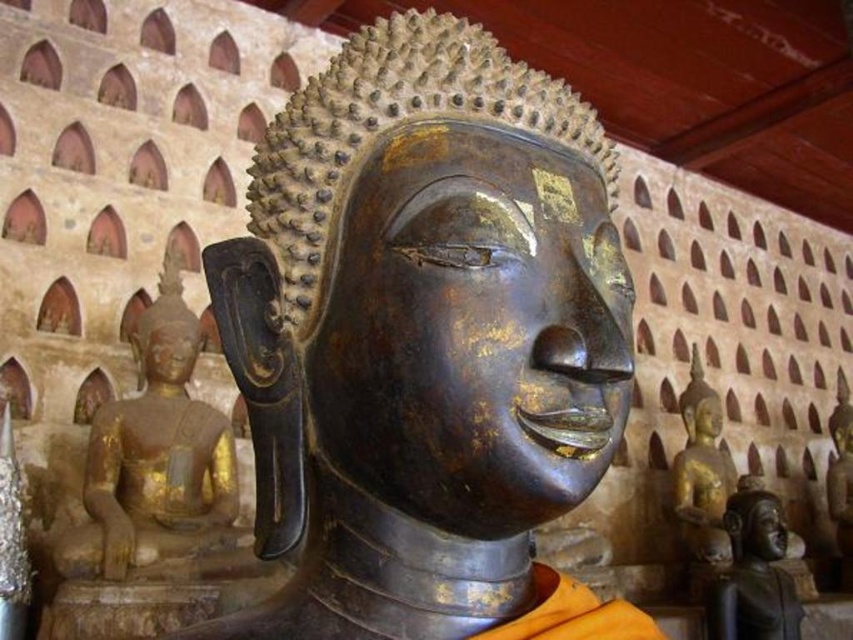
You are standing in front of the large Buddha statue and want to place a small offering at one of the two points marked in the image. The first point is at coordinates point (763, 564) and the second is at point (141, 385). Which point is closer to the large Buddha statue?

Point (141, 385) is closer to the large Buddha statue because it is in front of point (763, 564), which is positioned behind it.

You are standing in front of the large Buddha statue and notice two points marked on the statue. Which point is closer to you, point (781, 509) or point (756, 547)?

Answer: Point (781, 509) is further to the viewer than point (756, 547), so point (756, 547) is closer to you.

You are standing in front of the large Buddha statue and want to place a small offering at the exact location specified by the coordinates point (753, 572). Based on the image, where should you place the offering?

The bronze statue at lower right is located at point (753, 572), so you should place the offering there.